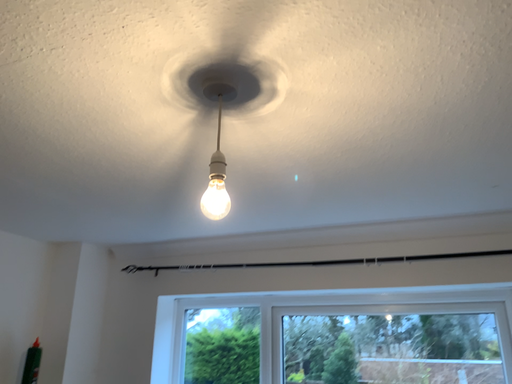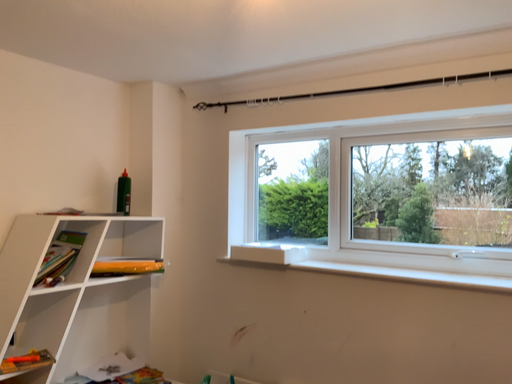
Question: Which way did the camera rotate in the video?

Choices:
 (A) rotated right
 (B) rotated left

Answer: (B)